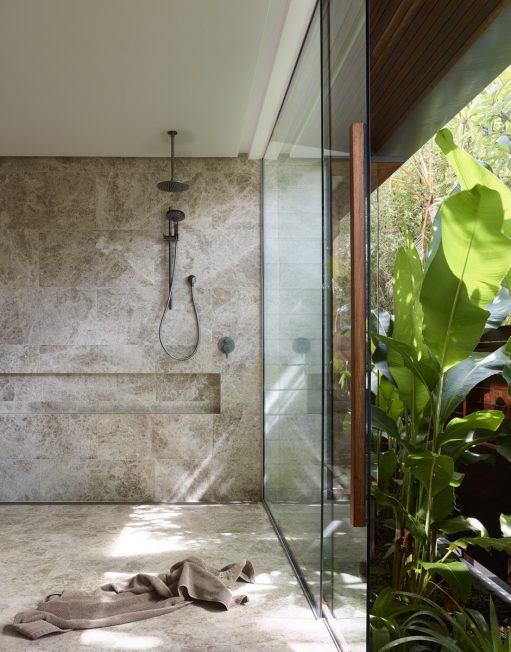
This screenshot has width=511, height=652. What are the coordinates of `shower wand` in the screenshot? It's located at (177, 214).